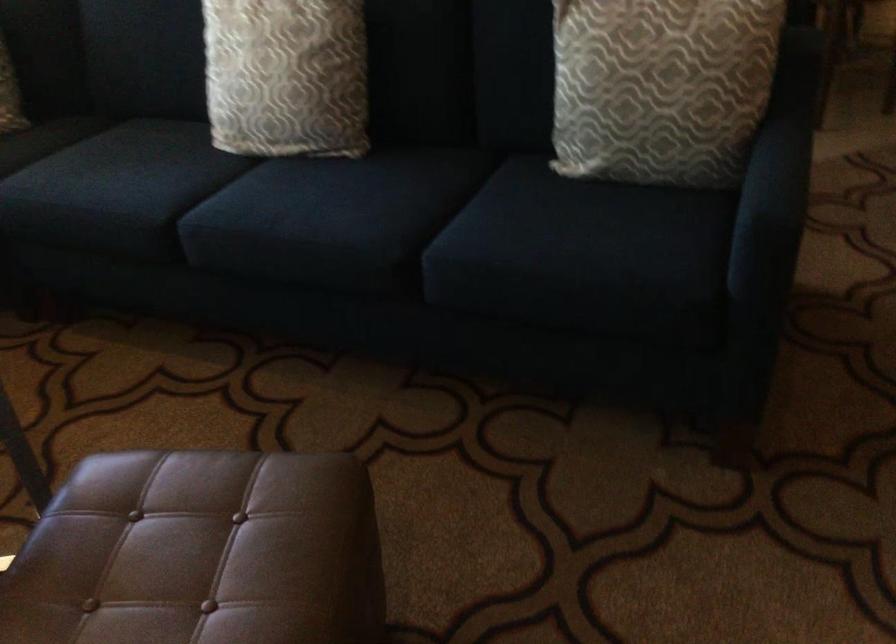
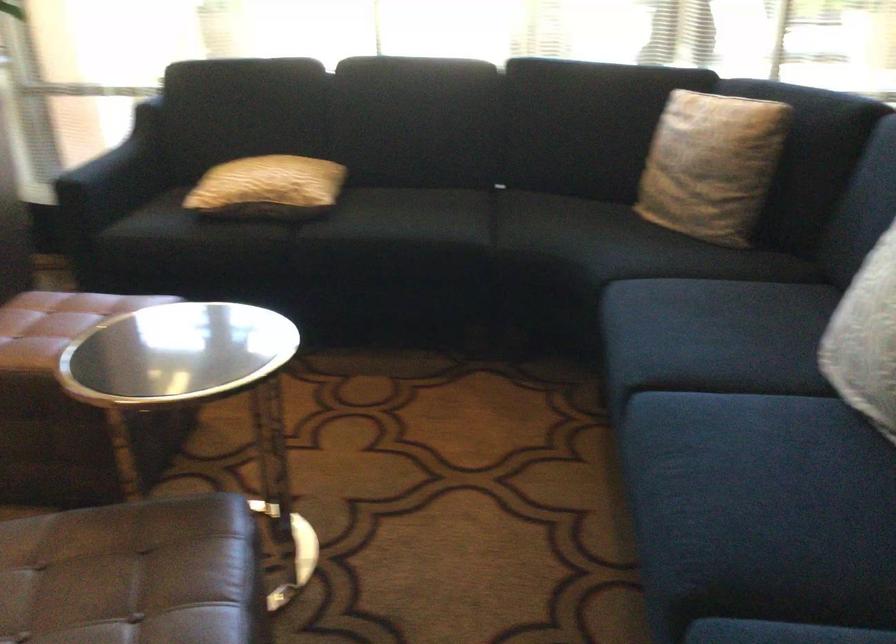
The point at (270, 107) is marked in the first image. Where is the corresponding point in the second image?

(866, 339)